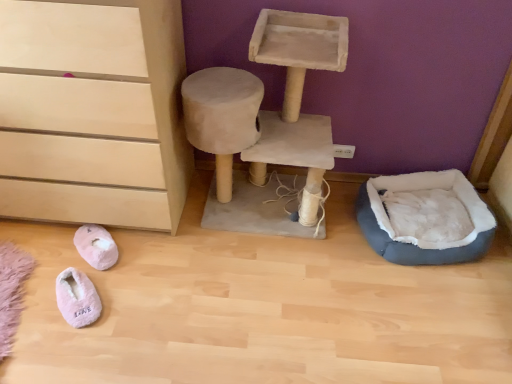
Question: Is gray plush pet bed at lower right surrounding pink fuzzy slippers at lower left, the first footwear viewed from the back?

Choices:
 (A) yes
 (B) no

Answer: (B)

Question: Does gray plush pet bed at lower right have a smaller size compared to pink fuzzy slippers at lower left, the second footwear in the front-to-back sequence?

Choices:
 (A) yes
 (B) no

Answer: (B)

Question: Does gray plush pet bed at lower right have a greater height compared to pink fuzzy slippers at lower left, the second footwear in the front-to-back sequence?

Choices:
 (A) no
 (B) yes

Answer: (B)

Question: Can you confirm if gray plush pet bed at lower right is thinner than pink fuzzy slippers at lower left, the second footwear in the front-to-back sequence?

Choices:
 (A) yes
 (B) no

Answer: (B)

Question: Is gray plush pet bed at lower right wider than pink fuzzy slippers at lower left, the second footwear in the front-to-back sequence?

Choices:
 (A) no
 (B) yes

Answer: (B)

Question: From a real-world perspective, relative to pink fluffy slippers at lower left, which is the first footwear from front to back, is pink fuzzy slippers at lower left, the first footwear viewed from the back, vertically above or below?

Choices:
 (A) above
 (B) below

Answer: (A)

Question: Visually, is pink fuzzy slippers at lower left, the first footwear viewed from the back, positioned to the left or to the right of pink fluffy slippers at lower left, which is the first footwear from front to back?

Choices:
 (A) left
 (B) right

Answer: (A)

Question: From the image's perspective, is pink fuzzy slippers at lower left, the first footwear viewed from the back, positioned above or below pink fluffy slippers at lower left, which is the first footwear from front to back?

Choices:
 (A) below
 (B) above

Answer: (B)

Question: Looking at the image, does pink fuzzy slippers at lower left, the second footwear in the front-to-back sequence, seem bigger or smaller compared to pink fluffy slippers at lower left, which is the first footwear from front to back?

Choices:
 (A) big
 (B) small

Answer: (B)

Question: From the image's perspective, is pink fluffy slippers at lower left, which is the first footwear from front to back, above or below matte wood chest of drawers at lower left?

Choices:
 (A) above
 (B) below

Answer: (B)

Question: Considering the positions of pink fluffy slippers at lower left, which is the first footwear from front to back, and matte wood chest of drawers at lower left in the image, is pink fluffy slippers at lower left, which is the first footwear from front to back, bigger or smaller than matte wood chest of drawers at lower left?

Choices:
 (A) big
 (B) small

Answer: (B)

Question: Choose the correct answer: Is pink fluffy slippers at lower left, which is the first footwear from front to back, inside matte wood chest of drawers at lower left or outside it?

Choices:
 (A) inside
 (B) outside

Answer: (B)

Question: Visually, is pink fluffy slippers at lower left, arranged as the 2th footwear when viewed from the back, positioned to the left or to the right of matte wood chest of drawers at lower left?

Choices:
 (A) right
 (B) left

Answer: (A)

Question: In the image, is matte wood chest of drawers at lower left positioned in front of or behind pink fluffy slippers at lower left, which is the first footwear from front to back?

Choices:
 (A) front
 (B) behind

Answer: (A)

Question: In terms of size, does matte wood chest of drawers at lower left appear bigger or smaller than pink fluffy slippers at lower left, arranged as the 2th footwear when viewed from the back?

Choices:
 (A) big
 (B) small

Answer: (A)